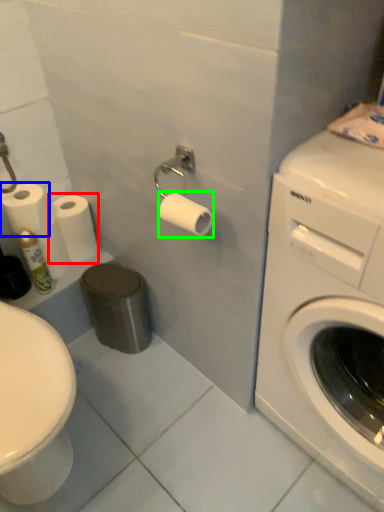
Question: Based on their relative distances, which object is nearer to toilet paper (highlighted by a red box)? Choose from toilet paper (highlighted by a blue box) and toilet paper (highlighted by a green box).

Choices:
 (A) toilet paper
 (B) toilet paper

Answer: (A)